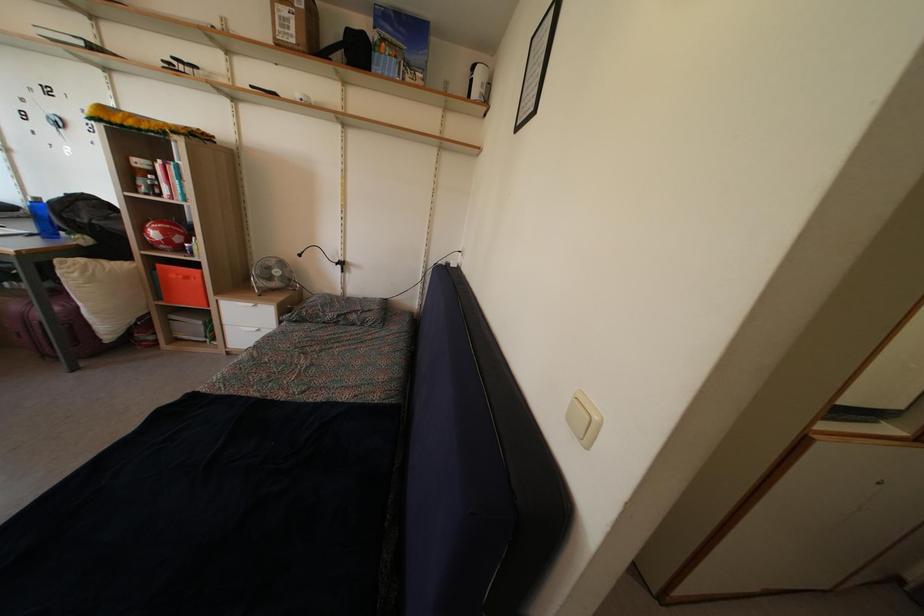
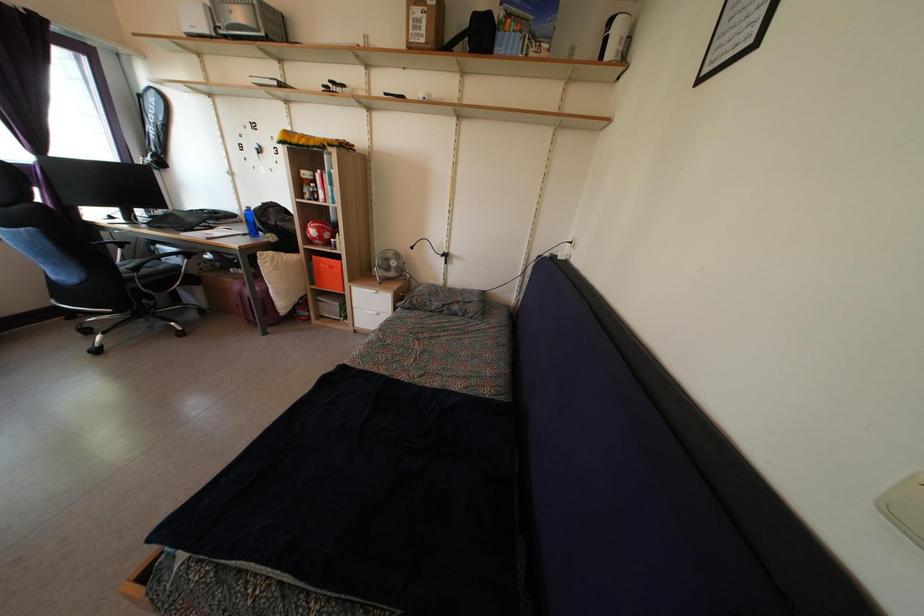
Question: The camera is either moving clockwise (left) or counter-clockwise (right) around the object. The first image is from the beginning of the video and the second image is from the end. Is the camera moving left or right when shooting the video?

Choices:
 (A) Left
 (B) Right

Answer: (B)